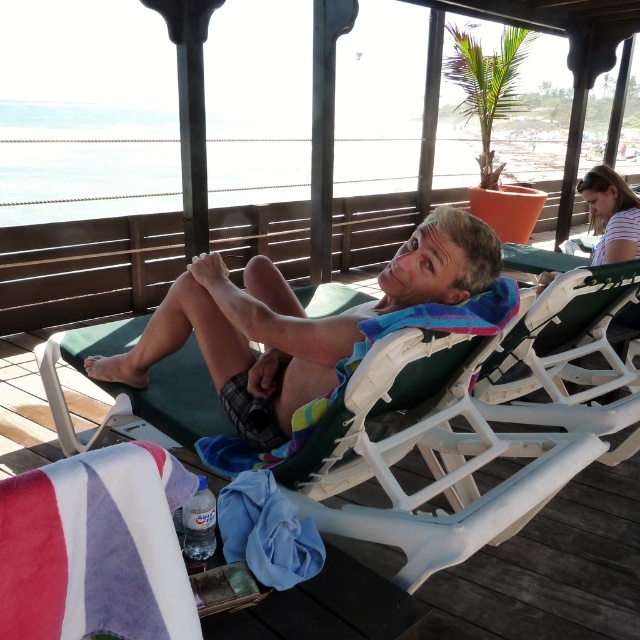
In the scene shown: You are standing at the wooden structure where the man is resting. You want to place a new beach towel exactly at the location marked by point (96, 547). What object is currently occupying that spot?

The velvet beach towel at lower left is currently occupying the location marked by point (96, 547).

You are at the beach and want to place your sunglasses on the closest object to you. You see the green plastic chair at center and the blue fabric towel at lower center. Which object should you place them on?

The blue fabric towel at lower center is closer to you than the green plastic chair at center, so you should place your sunglasses on the blue fabric towel at lower center.

You are a beach attendant who needs to arrange a new lounge set. The new set includes a large green plastic chair and a small blue fabric towel. According to the current setup shown in the image, will the size of the green plastic chair at center and blue fabric towel at lower center match the new items?

The green plastic chair at center is bigger than the blue fabric towel at lower center, which matches the new lounge set that includes a large green plastic chair and a small blue fabric towel. Therefore, the sizes align appropriately.